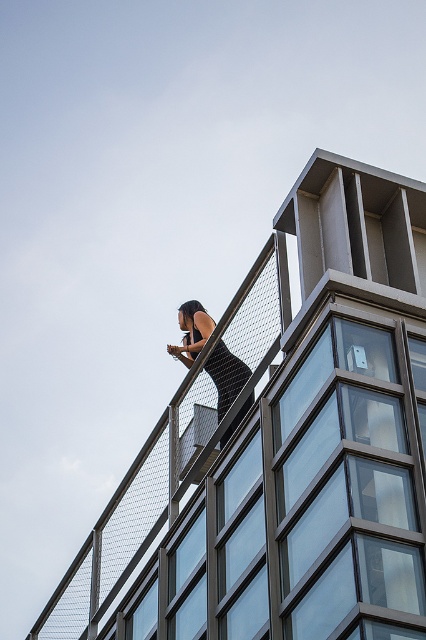
You are standing on the roof of the building and see the metal mesh fence at upper center and the black matte dress at upper center. Which object is positioned to the left side?

The metal mesh fence at upper center is to the left of the black matte dress at upper center, so the metal mesh fence at upper center is positioned to the left side.

You are a drone operator trying to deliver a package to a person standing near the metal mesh fence at upper center on the roof of a modern building. The building has a glass facade and metal framework. The drone must avoid the fence to ensure safe delivery. Based on the coordinates provided, can you determine if the drone can safely approach the person without hitting the fence?

The metal mesh fence at upper center is located at point [282,445], so the drone operator should adjust the drone path to avoid this coordinate to ensure safe delivery to the person near the fence.